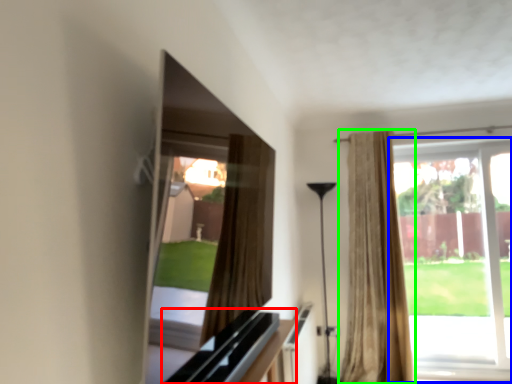
Question: Which object is positioned farthest from dresser (highlighted by a red box)? Select from window (highlighted by a blue box) and curtain (highlighted by a green box).

Choices:
 (A) window
 (B) curtain

Answer: (A)